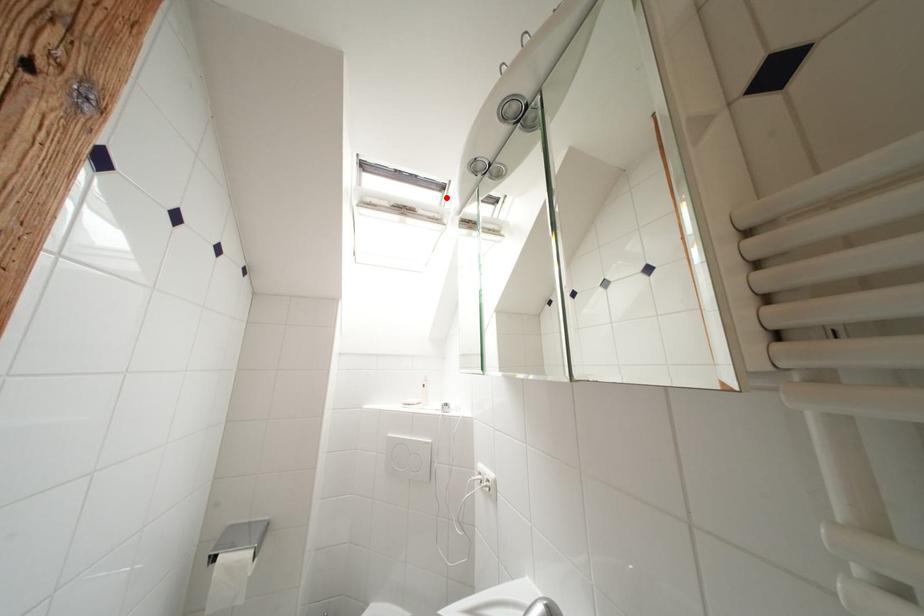
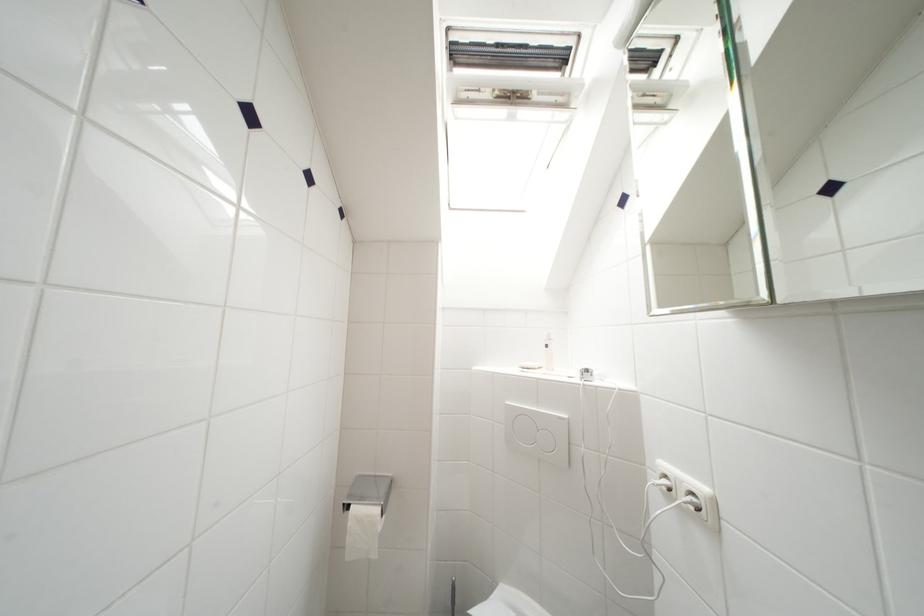
The point at the highlighted location is marked in the first image. Where is the corresponding point in the second image?

(565, 77)